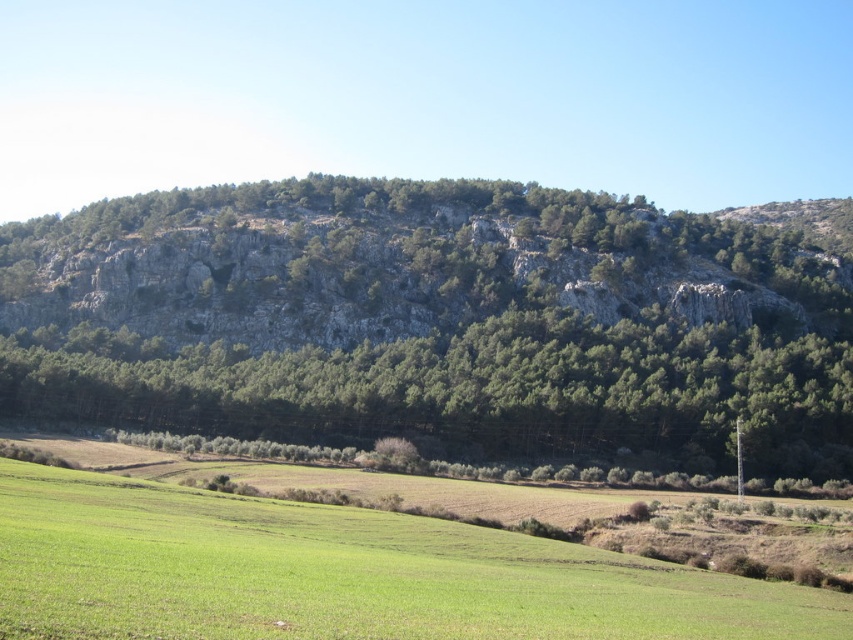
Question: Which of the following is the closest to the observer?

Choices:
 (A) rocky gray mountain at center
 (B) green grass pasture at lower left
 (C) green leafy trees at center

Answer: (B)

Question: Which object is positioned closest to the green leafy trees at center?

Choices:
 (A) rocky gray mountain at center
 (B) green grass pasture at lower left

Answer: (A)

Question: Can you confirm if green leafy trees at center is positioned to the left of green grass pasture at lower left?

Choices:
 (A) no
 (B) yes

Answer: (A)

Question: Can you confirm if rocky gray mountain at center is positioned above green leafy trees at center?

Choices:
 (A) no
 (B) yes

Answer: (B)

Question: Considering the real-world distances, which object is farthest from the green leafy trees at center?

Choices:
 (A) rocky gray mountain at center
 (B) green grass pasture at lower left

Answer: (B)

Question: Is rocky gray mountain at center to the right of green leafy trees at center from the viewer's perspective?

Choices:
 (A) yes
 (B) no

Answer: (A)